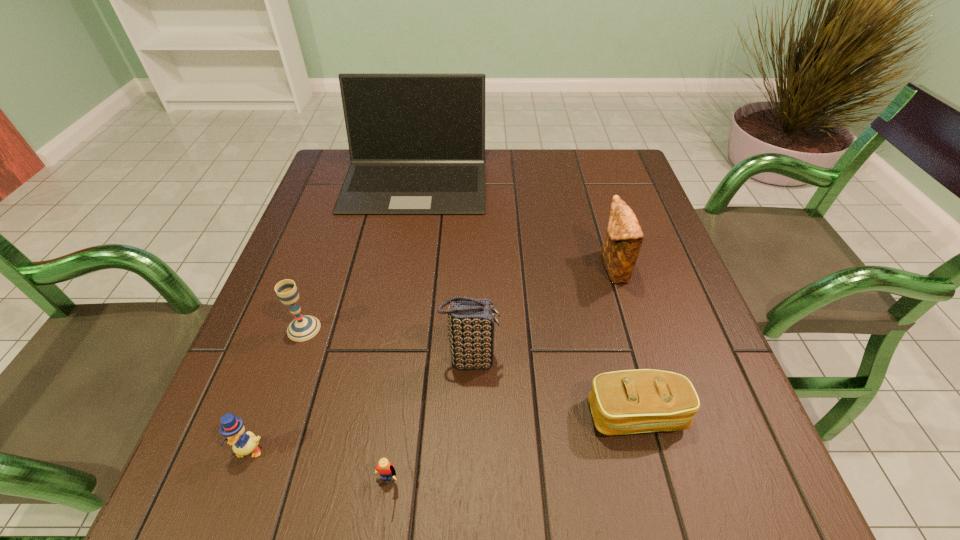
Identify which object is the sixth closest to the nearest clutch bag. Please provide its 2D coordinates. Your answer should be formatted as a tuple, i.e. [(x, y)], where the tuple contains the x and y coordinates of a point satisfying the conditions above.

[(232, 427)]

Identify which object is located as the sixth nearest to the farthest clutch bag. Please provide its 2D coordinates. Your answer should be formatted as a tuple, i.e. [(x, y)], where the tuple contains the x and y coordinates of a point satisfying the conditions above.

[(232, 427)]

This screenshot has width=960, height=540. I want to click on clutch bag that stands as the closest to the farthest clutch bag, so click(x=622, y=402).

You are a GUI agent. You are given a task and a screenshot of the screen. Output one action in this format:
    pyautogui.click(x=<x>, y=<y>)
    Task: Click on the clutch bag that stands as the second closest to the tallest object
    
    Given the screenshot: What is the action you would take?
    pyautogui.click(x=471, y=321)

Locate an element on the screen. free location that satisfies the following two spatial constraints: 1. on the open side of the sixth nearest object; 2. on the front-facing side of the Lego is located at coordinates (678, 487).

Find the location of a particular element. Image resolution: width=960 pixels, height=540 pixels. free space that satisfies the following two spatial constraints: 1. with the zip open on the second nearest clutch bag; 2. on the face of the duckling, where the monocle is placed is located at coordinates (468, 450).